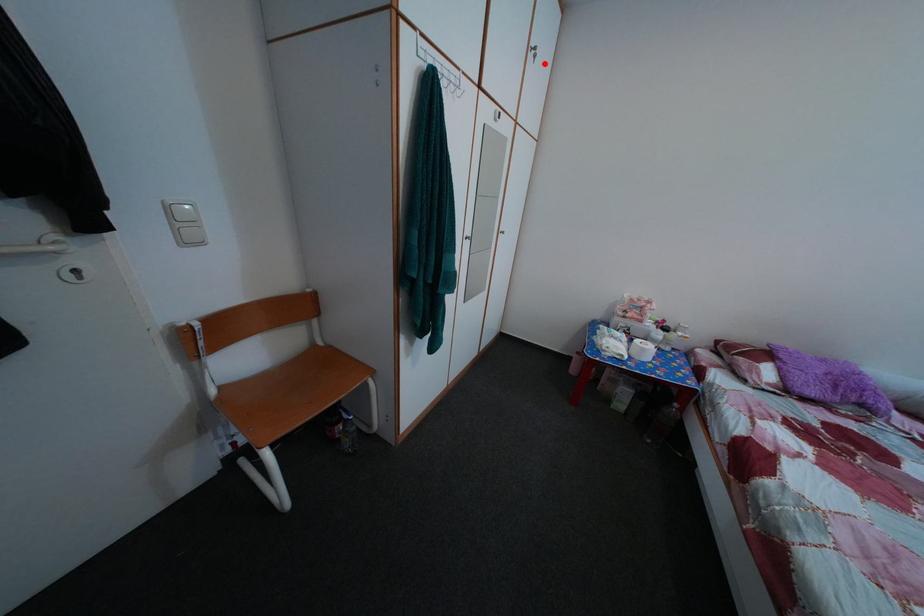
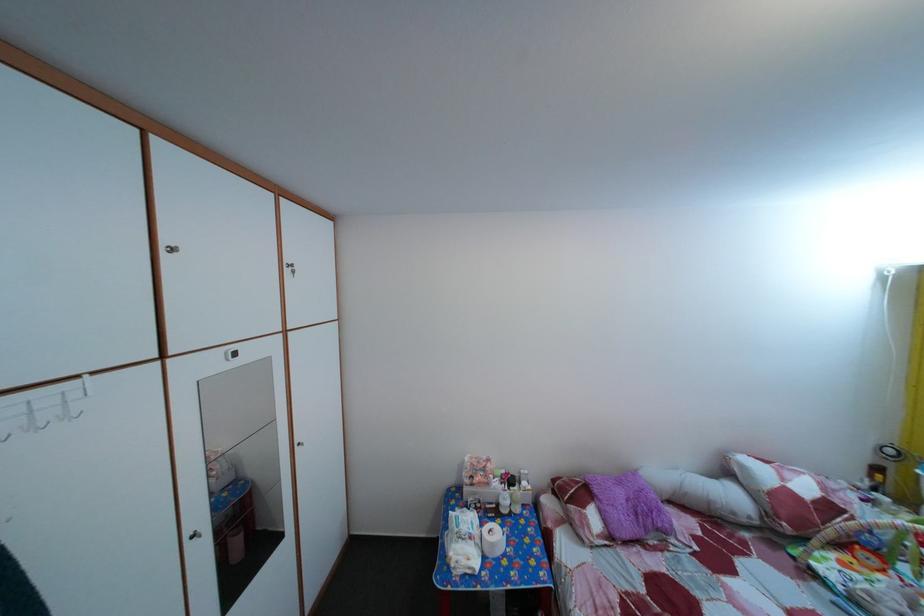
The point at the highlighted location is marked in the first image. Where is the corresponding point in the second image?

(304, 280)